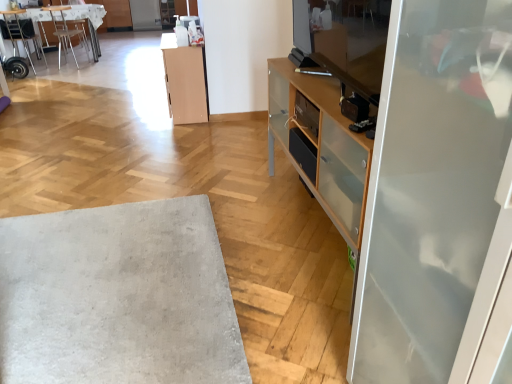
The image size is (512, 384). What are the coordinates of `vacant area that is in front of light wood cabinet at center` in the screenshot? It's located at (176, 129).